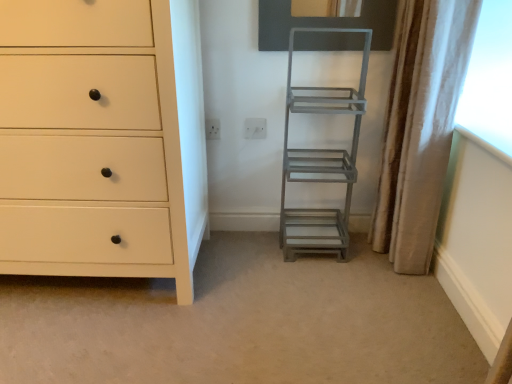
Question: Is white plastic electric outlet at center, marked as the first electric outlet in a right-to-left arrangement, positioned with its back to beige fabric curtain at right?

Choices:
 (A) yes
 (B) no

Answer: (B)

Question: Is white plastic electric outlet at center, the second electric outlet viewed from the left, not close to beige fabric curtain at right?

Choices:
 (A) no
 (B) yes

Answer: (A)

Question: Is the position of white plastic electric outlet at center, marked as the first electric outlet in a right-to-left arrangement, more distant than that of beige fabric curtain at right?

Choices:
 (A) no
 (B) yes

Answer: (B)

Question: Considering the relative sizes of white plastic electric outlet at center, marked as the first electric outlet in a right-to-left arrangement, and beige fabric curtain at right in the image provided, is white plastic electric outlet at center, marked as the first electric outlet in a right-to-left arrangement, bigger than beige fabric curtain at right?

Choices:
 (A) no
 (B) yes

Answer: (A)

Question: Is white plastic electric outlet at center, marked as the first electric outlet in a right-to-left arrangement, facing towards beige fabric curtain at right?

Choices:
 (A) no
 (B) yes

Answer: (A)

Question: Is matte white chest of drawers at left situated inside beige fabric curtain at right or outside?

Choices:
 (A) inside
 (B) outside

Answer: (B)

Question: Looking at their shapes, would you say matte white chest of drawers at left is wider or thinner than beige fabric curtain at right?

Choices:
 (A) thin
 (B) wide

Answer: (B)

Question: Is point (104, 34) positioned closer to the camera than point (444, 52)?

Choices:
 (A) closer
 (B) farther

Answer: (A)

Question: Would you say matte white chest of drawers at left is to the left or to the right of beige fabric curtain at right in the picture?

Choices:
 (A) left
 (B) right

Answer: (A)

Question: Is gray matte metal ladder at center-right taller or shorter than white plastic electric outlet at center, the second electric outlet viewed from the left?

Choices:
 (A) tall
 (B) short

Answer: (A)

Question: Considering their positions, is gray matte metal ladder at center-right located in front of or behind white plastic electric outlet at center, the second electric outlet viewed from the left?

Choices:
 (A) front
 (B) behind

Answer: (A)

Question: Would you say gray matte metal ladder at center-right is to the left or to the right of white plastic electric outlet at center, marked as the first electric outlet in a right-to-left arrangement, in the picture?

Choices:
 (A) right
 (B) left

Answer: (A)

Question: Is point (286, 167) closer or farther from the camera than point (256, 129)?

Choices:
 (A) closer
 (B) farther

Answer: (B)

Question: In the image, is beige fabric curtain at right on the left side or the right side of white plastic electric outlet at center, the 2th electric outlet in the right-to-left sequence?

Choices:
 (A) left
 (B) right

Answer: (B)

Question: In terms of height, does beige fabric curtain at right look taller or shorter compared to white plastic electric outlet at center, the 2th electric outlet in the right-to-left sequence?

Choices:
 (A) tall
 (B) short

Answer: (A)